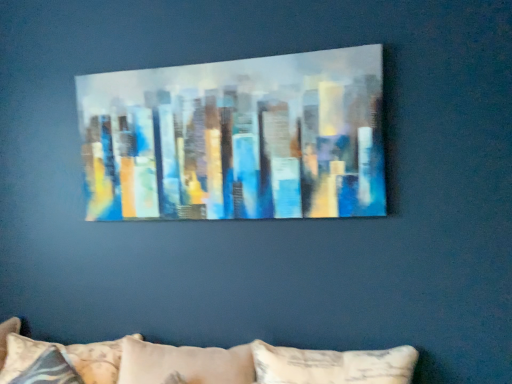
Question: From the image's perspective, is patterned fabric pillow at lower left above or below painted canvas cityscape at center?

Choices:
 (A) above
 (B) below

Answer: (B)

Question: From a real-world perspective, is patterned fabric pillow at lower left above or below painted canvas cityscape at center?

Choices:
 (A) above
 (B) below

Answer: (B)

Question: Relative to painted canvas cityscape at center, is patterned fabric pillow at lower left in front or behind?

Choices:
 (A) behind
 (B) front

Answer: (A)

Question: Considering the positions of painted canvas cityscape at center and patterned fabric pillow at lower left in the image, is painted canvas cityscape at center bigger or smaller than patterned fabric pillow at lower left?

Choices:
 (A) big
 (B) small

Answer: (B)

Question: In the image, is painted canvas cityscape at center on the left side or the right side of patterned fabric pillow at lower left?

Choices:
 (A) right
 (B) left

Answer: (A)

Question: From the image's perspective, is painted canvas cityscape at center above or below patterned fabric pillow at lower left?

Choices:
 (A) above
 (B) below

Answer: (A)

Question: Considering the positions of painted canvas cityscape at center and patterned fabric pillow at lower left in the image, is painted canvas cityscape at center wider or thinner than patterned fabric pillow at lower left?

Choices:
 (A) wide
 (B) thin

Answer: (B)